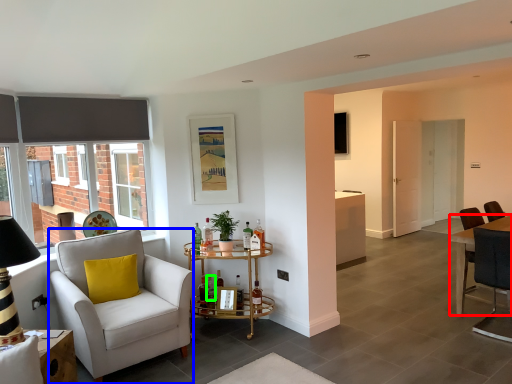
Question: Based on their relative distances, which object is farther from desk (highlighted by a red box)? Choose from chair (highlighted by a blue box) and bottle (highlighted by a green box).

Choices:
 (A) chair
 (B) bottle

Answer: (A)